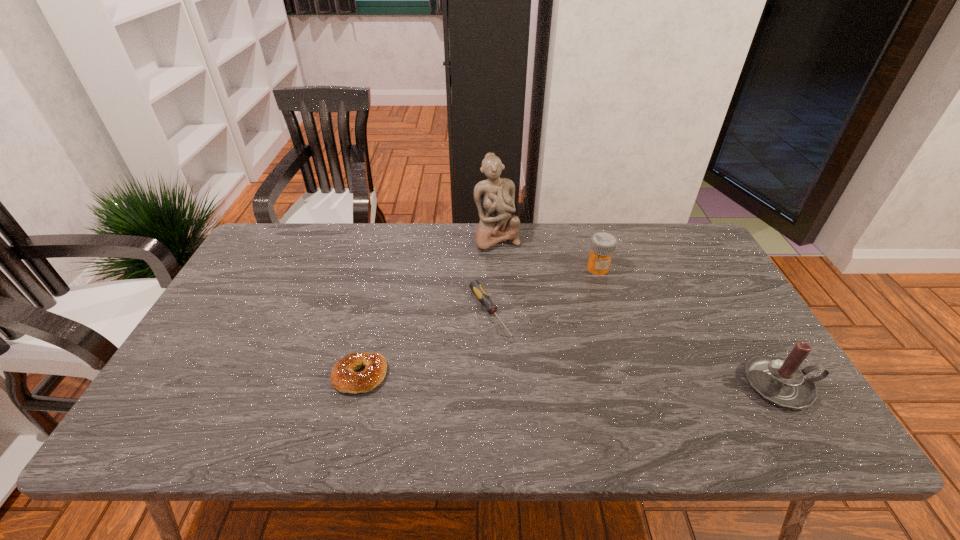
At what (x,y) coordinates should I click in order to perform the action: click on figurine that is at the far edge. Please return your answer as a coordinate pair (x, y). The height and width of the screenshot is (540, 960). Looking at the image, I should click on (494, 197).

You are a GUI agent. You are given a task and a screenshot of the screen. Output one action in this format:
    pyautogui.click(x=<x>, y=<y>)
    Task: Click on the medicine positioned at the far edge
    
    Given the screenshot: What is the action you would take?
    pyautogui.click(x=603, y=244)

Locate an element on the screen. bagel that is at the near edge is located at coordinates (343, 378).

Locate an element on the screen. The image size is (960, 540). candle present at the near edge is located at coordinates (780, 381).

In order to click on object present at the right edge in this screenshot , I will do `click(780, 381)`.

I want to click on object that is at the near right corner, so click(x=780, y=381).

In the image, there is a desktop. At what (x,y) coordinates should I click in order to perform the action: click on blank space at the far edge. Please return your answer as a coordinate pair (x, y). This screenshot has width=960, height=540. Looking at the image, I should click on (536, 255).

In the image, there is a desktop. Where is `vacant space at the near edge`? vacant space at the near edge is located at coordinates (383, 394).

This screenshot has height=540, width=960. Identify the location of vacant point at the left edge. (249, 352).

Where is `free space at the right edge of the desktop`? The image size is (960, 540). free space at the right edge of the desktop is located at coordinates (772, 354).